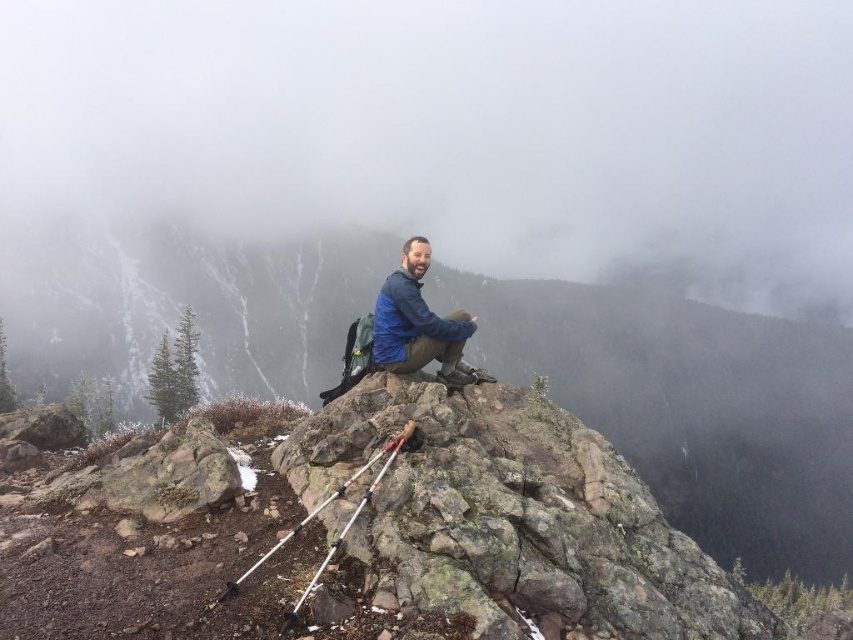
You are a drone operator tasked with capturing aerial footage of the hiker. The drone has a maximum range of 500 meters. If you are controlling the drone from the white fog at upper center, can you safely fly the drone to the blue softshell jacket at center without exceeding its range?

The white fog at upper center and blue softshell jacket at center are 479.61 meters apart from each other. Since the drone has a maximum range of 500 meters, the distance of 479.61 meters is within the limit. Therefore, you can safely fly the drone from the white fog at upper center to the blue softshell jacket at center without exceeding its range.

You are a hiker who wants to take a photo of the white fog at upper center located at point (456, 129). Can you confirm if the white fog at upper center is visible from your current position?

The white fog at upper center is located at point (456, 129), so yes, it is visible from your current position as it is directly in front of you.